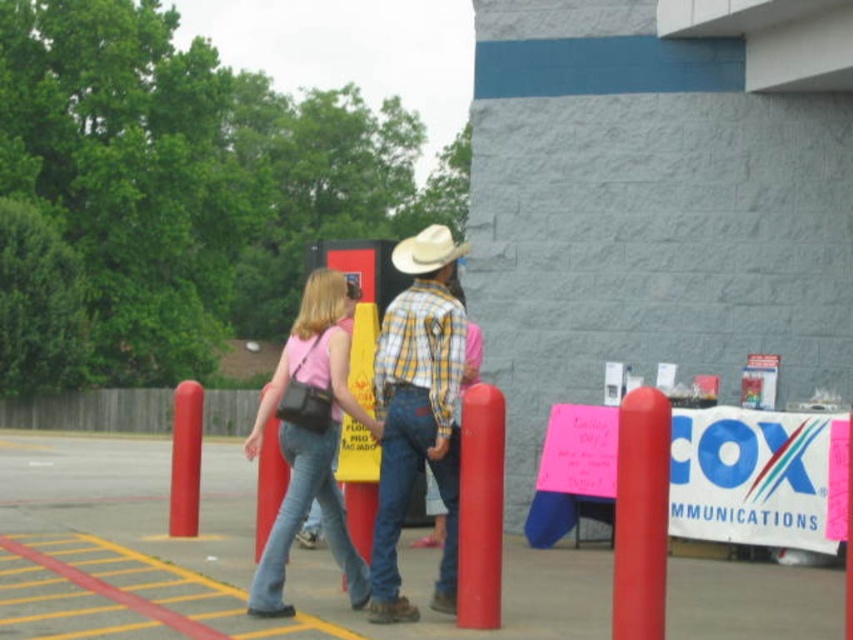
Which is below, smooth glossy red post at center or matte black bag at center?

smooth glossy red post at center is lower down.

Is smooth glossy red post at center closer to camera compared to matte black bag at center?

Yes, it is.

This screenshot has height=640, width=853. Identify the location of smooth glossy red post at center. (480, 508).

The height and width of the screenshot is (640, 853). Identify the location of smooth glossy red post at center. (480, 508).

Measure the distance between point (426, 300) and camera.

They are 27.47 feet apart.

Does plaid shirt at center come behind smooth matte red post at center right?

Yes, it is behind smooth matte red post at center right.

Describe the element at coordinates (416, 412) in the screenshot. I see `plaid shirt at center` at that location.

Locate an element on the screen. The image size is (853, 640). plaid shirt at center is located at coordinates (416, 412).

Between matte black bag at center and light brown felt cowboy hat at center, which one has less height?

matte black bag at center

Can you confirm if matte black bag at center is wider than light brown felt cowboy hat at center?

In fact, matte black bag at center might be narrower than light brown felt cowboy hat at center.

Does point (265, 508) lie in front of point (405, 252)?

No, (265, 508) is further to viewer.

Where is `matte black bag at center`? The height and width of the screenshot is (640, 853). matte black bag at center is located at coordinates (268, 483).